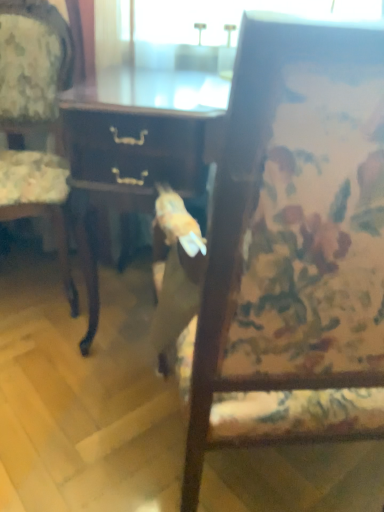
Question: Which direction should I rotate to face wooden chair at center, arranged as the first chair when viewed from the right, — up or down?

Choices:
 (A) down
 (B) up

Answer: (A)

Question: Is wooden chair at center, which is the 2th chair in left-to-right order, far from wooden floral-patterned chair at left, which appears as the 1th chair when viewed from the left?

Choices:
 (A) yes
 (B) no

Answer: (A)

Question: Is wooden chair at center, which is the 2th chair in left-to-right order, wider than wooden floral-patterned chair at left, which appears as the 1th chair when viewed from the left?

Choices:
 (A) yes
 (B) no

Answer: (A)

Question: Is wooden chair at center, arranged as the first chair when viewed from the right, facing away from wooden floral-patterned chair at left, which appears as the 1th chair when viewed from the left?

Choices:
 (A) yes
 (B) no

Answer: (B)

Question: Is wooden chair at center, arranged as the first chair when viewed from the right, at the right side of wooden floral-patterned chair at left, placed as the second chair when sorted from right to left?

Choices:
 (A) yes
 (B) no

Answer: (A)

Question: Considering the relative positions of wooden chair at center, which is the 2th chair in left-to-right order, and wooden floral-patterned chair at left, placed as the second chair when sorted from right to left, in the image provided, is wooden chair at center, which is the 2th chair in left-to-right order, to the left of wooden floral-patterned chair at left, placed as the second chair when sorted from right to left, from the viewer's perspective?

Choices:
 (A) no
 (B) yes

Answer: (A)

Question: From a real-world perspective, is wooden chair at center, arranged as the first chair when viewed from the right, under wooden floral-patterned chair at left, which appears as the 1th chair when viewed from the left?

Choices:
 (A) no
 (B) yes

Answer: (A)

Question: Is wooden chair at center, which is the 2th chair in left-to-right order, bigger than wooden desk at center?

Choices:
 (A) yes
 (B) no

Answer: (A)

Question: From the image's perspective, does wooden chair at center, which is the 2th chair in left-to-right order, appear higher than wooden desk at center?

Choices:
 (A) yes
 (B) no

Answer: (B)

Question: Is wooden chair at center, which is the 2th chair in left-to-right order, positioned in front of wooden desk at center?

Choices:
 (A) yes
 (B) no

Answer: (A)

Question: Does wooden chair at center, which is the 2th chair in left-to-right order, have a smaller size compared to wooden desk at center?

Choices:
 (A) no
 (B) yes

Answer: (A)

Question: Is wooden chair at center, which is the 2th chair in left-to-right order, not within wooden desk at center?

Choices:
 (A) no
 (B) yes

Answer: (B)

Question: Can you confirm if wooden chair at center, arranged as the first chair when viewed from the right, is wider than wooden desk at center?

Choices:
 (A) yes
 (B) no

Answer: (A)

Question: Considering the relative sizes of wooden floral-patterned chair at left, placed as the second chair when sorted from right to left, and wooden desk at center in the image provided, is wooden floral-patterned chair at left, placed as the second chair when sorted from right to left, wider than wooden desk at center?

Choices:
 (A) yes
 (B) no

Answer: (B)